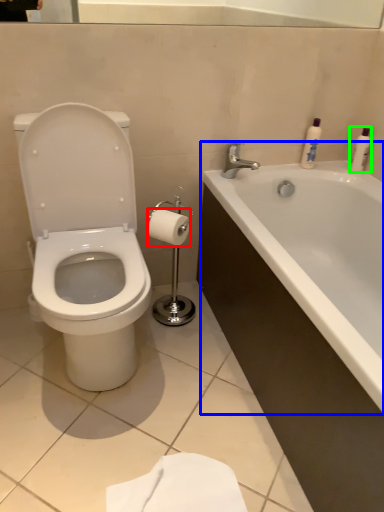
Question: Which object is positioned closest to toilet paper (highlighted by a red box)? Select from bathtub (highlighted by a blue box) and toiletry (highlighted by a green box).

Choices:
 (A) bathtub
 (B) toiletry

Answer: (A)